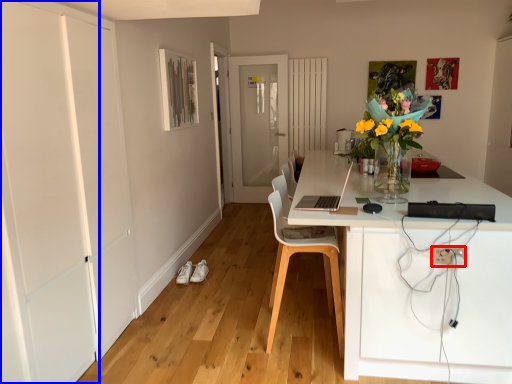
Question: Which point is closer to the camera, electric outlet (highlighted by a red box) or door (highlighted by a blue box)?

Choices:
 (A) electric outlet
 (B) door

Answer: (B)